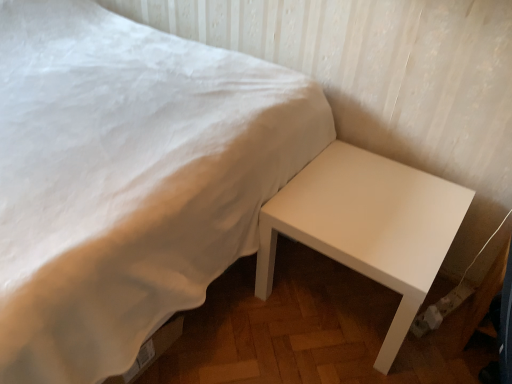
Question: Considering the positions of white glossy table at lower right and white matte bed at lower right in the image, is white glossy table at lower right bigger or smaller than white matte bed at lower right?

Choices:
 (A) big
 (B) small

Answer: (B)

Question: Visually, is white glossy table at lower right positioned to the left or to the right of white matte bed at lower right?

Choices:
 (A) right
 (B) left

Answer: (A)

Question: From the image's perspective, relative to white matte bed at lower right, is white glossy table at lower right above or below?

Choices:
 (A) below
 (B) above

Answer: (A)

Question: Is white matte bed at lower right to the left or to the right of white glossy table at lower right in the image?

Choices:
 (A) right
 (B) left

Answer: (B)

Question: Is white matte bed at lower right bigger or smaller than white glossy table at lower right?

Choices:
 (A) big
 (B) small

Answer: (A)

Question: From a real-world perspective, is white matte bed at lower right positioned above or below white glossy table at lower right?

Choices:
 (A) above
 (B) below

Answer: (A)

Question: Is point (7, 350) positioned closer to the camera than point (336, 218)?

Choices:
 (A) closer
 (B) farther

Answer: (A)